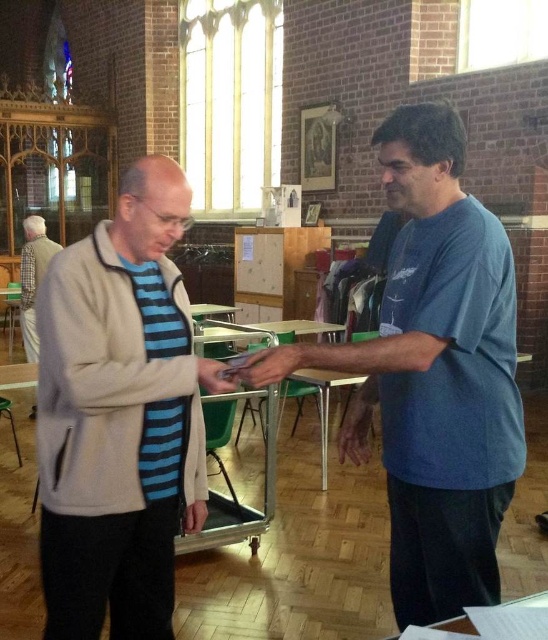
Question: From the image, what is the correct spatial relationship of light beige fleece jacket at center in relation to white glossy table at lower center?

Choices:
 (A) below
 (B) above

Answer: (B)

Question: Is blue cotton shirt at right bigger than light brown wooden hand at center?

Choices:
 (A) no
 (B) yes

Answer: (B)

Question: Estimate the real-world distances between objects in this image. Which object is farther from the matte black phone at center?

Choices:
 (A) light brown sweater at left
 (B) matte black hand at center
 (C) light brown wooden hand at center

Answer: (A)

Question: Which point is farther from the camera taking this photo?

Choices:
 (A) (450, 499)
 (B) (248, 376)

Answer: (A)

Question: Is matte black hand at center to the left of light brown wooden hand at center from the viewer's perspective?

Choices:
 (A) yes
 (B) no

Answer: (A)

Question: Which point is closer to the camera?

Choices:
 (A) matte black hand at center
 (B) light brown wooden hand at center

Answer: (A)